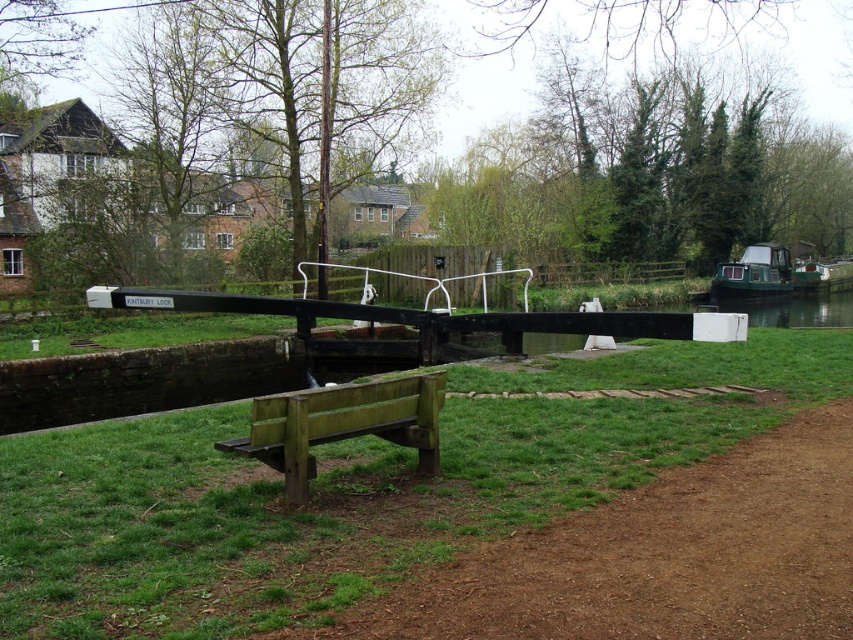
Question: Based on their relative distances, which object is nearer to the green matte boat at right?

Choices:
 (A) brown dirt path at lower right
 (B) green grass at center

Answer: (B)

Question: Does green grass at center appear on the left side of brown dirt path at lower right?

Choices:
 (A) yes
 (B) no

Answer: (A)

Question: Does green grass at center have a smaller size compared to green weathered wood bench at lower center?

Choices:
 (A) no
 (B) yes

Answer: (A)

Question: Is green grass at center closer to camera compared to brown dirt path at lower right?

Choices:
 (A) no
 (B) yes

Answer: (B)

Question: Which of the following is the farthest from the observer?

Choices:
 (A) green grass at center
 (B) green weathered wood bench at lower center

Answer: (B)

Question: Which of these objects is positioned closest to the brown dirt path at lower right?

Choices:
 (A) green weathered wood bench at lower center
 (B) green grass at center

Answer: (A)